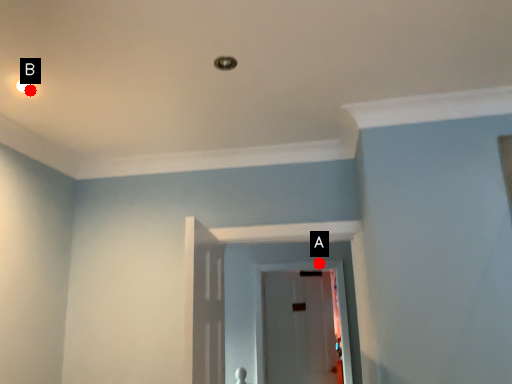
Question: Two points are circled on the image, labeled by A and B beside each circle. Which point is farther from the camera taking this photo?

Choices:
 (A) A is further
 (B) B is further

Answer: (A)